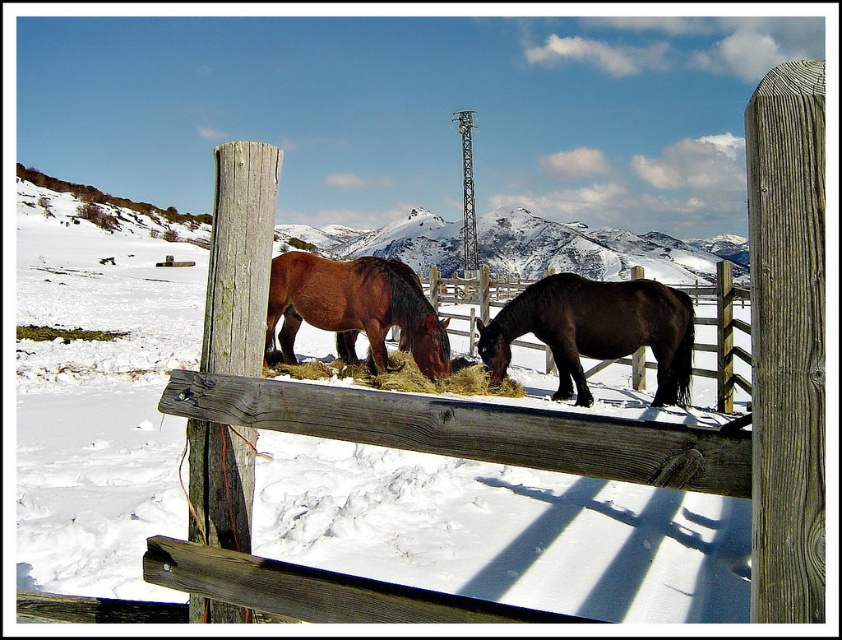
Is weathered wood post at center taller than shiny dark brown horse at center?

No, weathered wood post at center is not taller than shiny dark brown horse at center.

Does weathered wood post at center have a lesser height compared to shiny dark brown horse at center?

Yes, weathered wood post at center is shorter than shiny dark brown horse at center.

Between point (205, 362) and point (670, 333), which one is positioned in front?

Point (205, 362)

Identify the location of weathered wood post at center. (238, 257).

Can you confirm if white powdery snow at center is positioned to the right of shiny dark brown horse at center?

Incorrect, white powdery snow at center is not on the right side of shiny dark brown horse at center.

Who is shorter, white powdery snow at center or shiny dark brown horse at center?

With less height is shiny dark brown horse at center.

Where is `white powdery snow at center`? white powdery snow at center is located at coordinates (502, 531).

Find the location of a particular element. This screenshot has height=640, width=842. weathered wood post at center is located at coordinates (238, 257).

Between weathered wood post at center and golden straw at center, which one appears on the left side from the viewer's perspective?

From the viewer's perspective, golden straw at center appears more on the left side.

Between point (259, 243) and point (459, 371), which one is positioned behind?

Point (459, 371)

You are a GUI agent. You are given a task and a screenshot of the screen. Output one action in this format:
    pyautogui.click(x=<x>, y=<y>)
    Task: Click on the weathered wood post at center
    The image size is (842, 640).
    Given the screenshot: What is the action you would take?
    tap(238, 257)